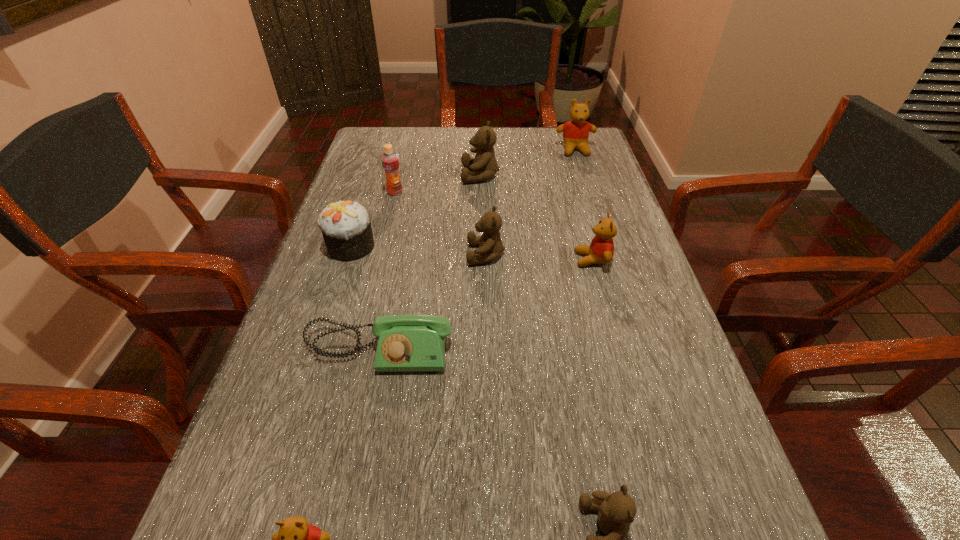
Identify the location of the farthest brown teddy bear. The height and width of the screenshot is (540, 960). (484, 164).

You are a GUI agent. You are given a task and a screenshot of the screen. Output one action in this format:
    pyautogui.click(x=<x>, y=<y>)
    Task: Click on the second farthest object
    This screenshot has height=540, width=960.
    Given the screenshot: What is the action you would take?
    pyautogui.click(x=484, y=164)

Where is `the farthest red teddy bear`? the farthest red teddy bear is located at coordinates point(576,131).

This screenshot has height=540, width=960. Identify the location of the biggest red teddy bear. (576, 131).

Identify the location of the seventh nearest object. (390, 161).

Image resolution: width=960 pixels, height=540 pixels. Identify the location of the second nearest red teddy bear. (601, 250).

The width and height of the screenshot is (960, 540). What are the coordinates of `the second farthest brown teddy bear` in the screenshot? It's located at (490, 245).

Where is `cupcake`? This screenshot has height=540, width=960. cupcake is located at coordinates (346, 227).

Where is `telephone`? telephone is located at coordinates (406, 343).

Find the location of a particular element. The height and width of the screenshot is (540, 960). the shortest object is located at coordinates (406, 343).